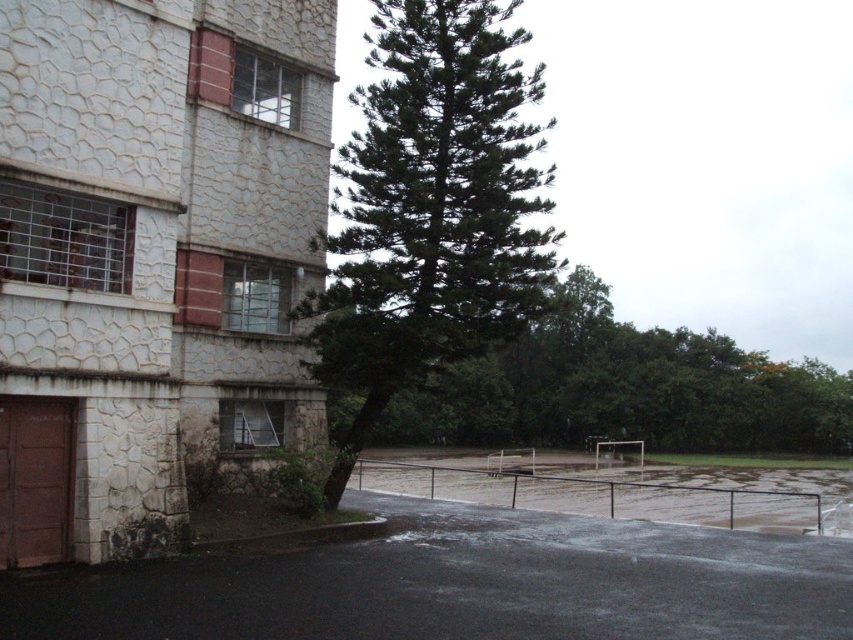
You are standing at the sports field and want to take a photo of the building. You have two points marked on your camera screen, point A at coordinates point [379,173] and point B at coordinates point [334,419]. Which point is closer to you when you aim your camera towards the building?

Point A at coordinates point [379,173] is closer to you than point B at coordinates point [334,419] because it is nearer to the viewer.